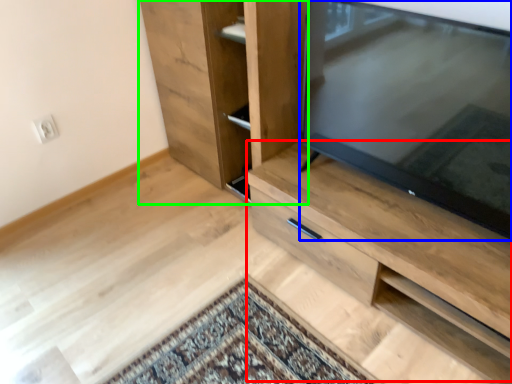
Question: Based on their relative distances, which object is farther from cabinetry (highlighted by a red box)? Choose from television (highlighted by a blue box) and cupboard (highlighted by a green box).

Choices:
 (A) television
 (B) cupboard

Answer: (B)